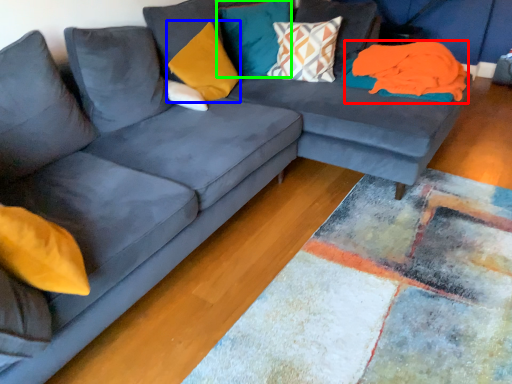
Question: Which is farther away from material (highlighted by a red box)? pillow (highlighted by a blue box) or pillow (highlighted by a green box)?

Choices:
 (A) pillow
 (B) pillow

Answer: (A)